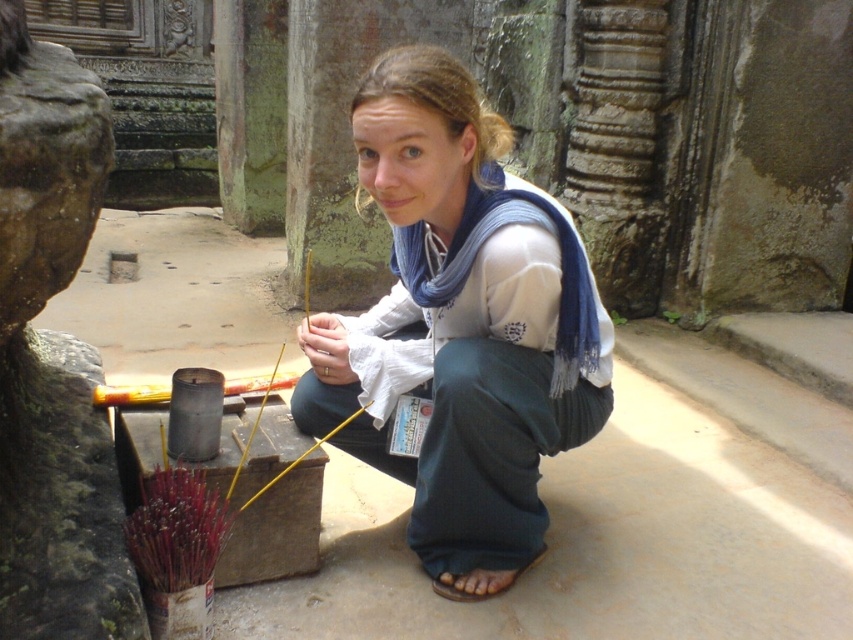
Question: Which of the following is the closest to the observer?

Choices:
 (A) brown leather sandal at lower center
 (B) white cotton scarf at center

Answer: (B)

Question: Is smooth stone statue at left below brown leather sandal at lower center?

Choices:
 (A) yes
 (B) no

Answer: (B)

Question: Which of these objects is positioned closest to the white cotton scarf at center?

Choices:
 (A) smooth stone statue at left
 (B) brown leather sandal at lower center

Answer: (B)

Question: Which object is positioned closest to the white cotton scarf at center?

Choices:
 (A) smooth stone statue at left
 (B) brown leather sandal at lower center

Answer: (B)

Question: Is white cotton scarf at center bigger than smooth stone statue at left?

Choices:
 (A) no
 (B) yes

Answer: (A)

Question: Can you confirm if white cotton scarf at center is wider than smooth stone statue at left?

Choices:
 (A) yes
 (B) no

Answer: (A)